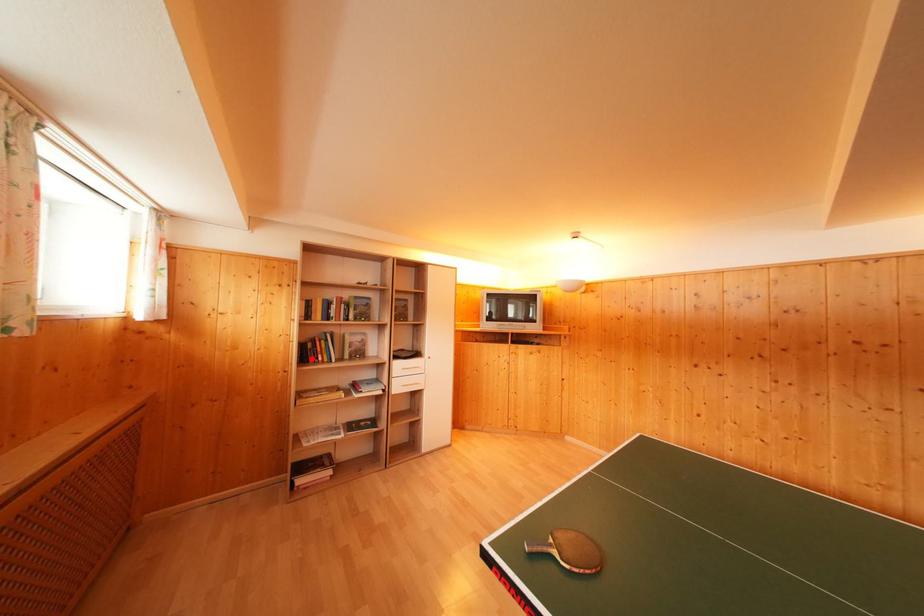
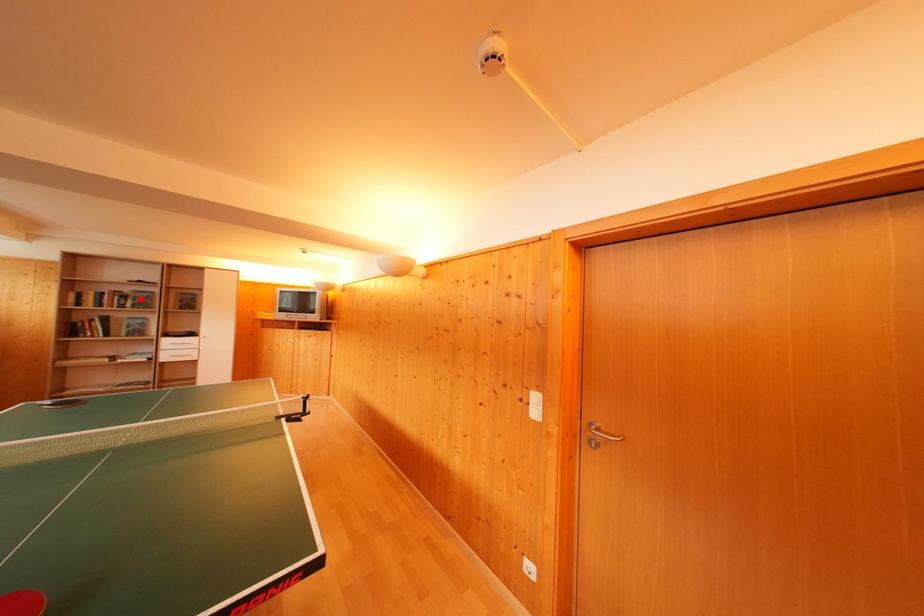
I am providing you with two images of the same scene from different viewpoints. A red point is marked on the first image and another point is marked on the second image. Are the points marked in image1 and image2 representing the same 3D position?

No